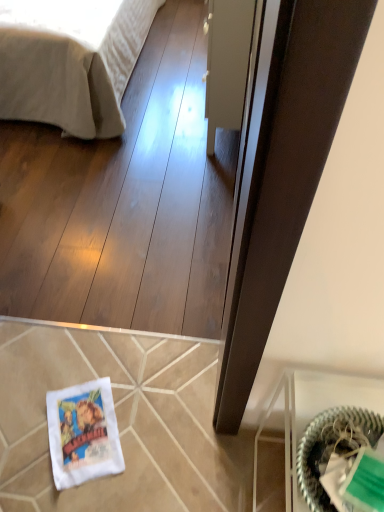
Locate an element on the screen. This screenshot has width=384, height=512. unoccupied space behind transparent glass door at center is located at coordinates (179, 65).